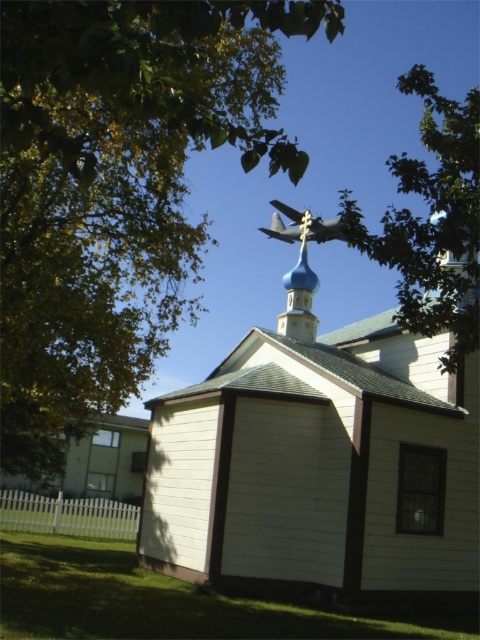
Is green leafy tree at upper left in front of metallic gray airplane at upper center?

Yes, it is.

Who is shorter, green leafy tree at upper left or metallic gray airplane at upper center?

metallic gray airplane at upper center is shorter.

Is point (83, 84) behind point (317, 227)?

No, (83, 84) is closer to viewer.

This screenshot has width=480, height=640. Identify the location of green leafy tree at upper left. (117, 188).

From the picture: How far apart are green leafy tree at upper left and blue glossy dome at center?

green leafy tree at upper left and blue glossy dome at center are 6.85 meters apart from each other.

Who is taller, green leafy tree at upper left or blue glossy dome at center?

green leafy tree at upper left is taller.

What do you see at coordinates (117, 188) in the screenshot? Image resolution: width=480 pixels, height=640 pixels. I see `green leafy tree at upper left` at bounding box center [117, 188].

The image size is (480, 640). I want to click on green leafy tree at upper left, so click(117, 188).

Describe the element at coordinates (320, 468) in the screenshot. The height and width of the screenshot is (640, 480). I see `white wood chapel at center` at that location.

Does white wood chapel at center have a larger size compared to blue glossy dome at center?

Indeed, white wood chapel at center has a larger size compared to blue glossy dome at center.

Is point (186, 492) closer to viewer compared to point (310, 308)?

Yes.

This screenshot has width=480, height=640. Find the location of `white wood chapel at center`. white wood chapel at center is located at coordinates (320, 468).